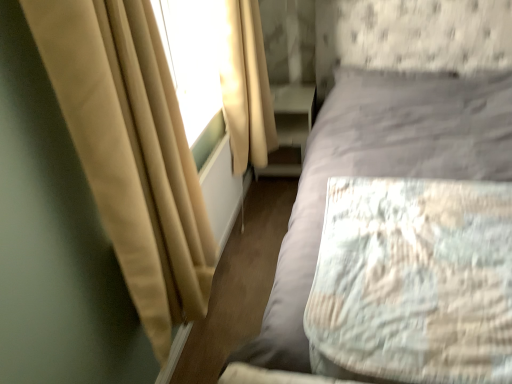
Where is `light gray fabric mattress at right`? This screenshot has width=512, height=384. light gray fabric mattress at right is located at coordinates (414, 280).

From a real-world perspective, is light gray fabric mattress at right located beneath beige fabric curtain at left, which appears as the first curtain when viewed from the front?

Indeed, from a real-world perspective, light gray fabric mattress at right is positioned beneath beige fabric curtain at left, which appears as the first curtain when viewed from the front.

Is light gray fabric mattress at right placed right next to beige fabric curtain at left, which appears as the first curtain when viewed from the front?

light gray fabric mattress at right and beige fabric curtain at left, which appears as the first curtain when viewed from the front, are clearly separated.

In the scene shown: Considering the relative positions of light gray fabric mattress at right and beige fabric curtain at left, placed as the 2th curtain when sorted from back to front, in the image provided, is light gray fabric mattress at right to the left of beige fabric curtain at left, placed as the 2th curtain when sorted from back to front, from the viewer's perspective?

In fact, light gray fabric mattress at right is to the right of beige fabric curtain at left, placed as the 2th curtain when sorted from back to front.

From the picture: From their relative heights in the image, would you say textured gray bed at center is taller or shorter than beige fabric curtain at upper left, arranged as the second curtain when viewed from the front?

textured gray bed at center is taller than beige fabric curtain at upper left, arranged as the second curtain when viewed from the front.

From a real-world perspective, count 1st curtains upward from the textured gray bed at center and point to it. Please provide its 2D coordinates.

[(245, 85)]

Does textured gray bed at center appear on the right side of beige fabric curtain at upper left, arranged as the second curtain when viewed from the front?

Yes.

In terms of height, does textured gray bed at center look taller or shorter compared to light gray fabric mattress at right?

Considering their sizes, textured gray bed at center has more height than light gray fabric mattress at right.

Is textured gray bed at center beside light gray fabric mattress at right?

There is a gap between textured gray bed at center and light gray fabric mattress at right.

Considering the relative positions of textured gray bed at center and light gray fabric mattress at right in the image provided, is textured gray bed at center behind light gray fabric mattress at right?

No, textured gray bed at center is in front of light gray fabric mattress at right.

Can you confirm if textured gray bed at center is wider than light gray fabric mattress at right?

Yes.

From a real-world perspective, is matte white dresser at lower center positioned over light gray fabric mattress at right based on gravity?

Incorrect, from a real-world perspective, matte white dresser at lower center is lower than light gray fabric mattress at right.

Does matte white dresser at lower center come behind light gray fabric mattress at right?

Yes, it is.

How much distance is there between matte white dresser at lower center and light gray fabric mattress at right?

matte white dresser at lower center is 4.51 feet away from light gray fabric mattress at right.

Find the location of a particular element. This screenshot has height=384, width=512. dresser below the light gray fabric mattress at right (from a real-world perspective) is located at coordinates (291, 125).

Is beige fabric curtain at upper left, arranged as the second curtain when viewed from the front, surrounded by beige fabric curtain at left, placed as the 2th curtain when sorted from back to front?

No, beige fabric curtain at upper left, arranged as the second curtain when viewed from the front, is not surrounded by beige fabric curtain at left, placed as the 2th curtain when sorted from back to front.

Who is shorter, beige fabric curtain at left, which appears as the first curtain when viewed from the front, or beige fabric curtain at upper left, the 1th curtain when ordered from back to front?

beige fabric curtain at upper left, the 1th curtain when ordered from back to front, is shorter.

Which is less distant, (160,75) or (260,116)?

Point (160,75) is closer to the camera than point (260,116).

From a real-world perspective, which is physically below, beige fabric curtain at left, which appears as the first curtain when viewed from the front, or beige fabric curtain at upper left, the 1th curtain when ordered from back to front?

beige fabric curtain at upper left, the 1th curtain when ordered from back to front, is physically lower.

Is beige fabric curtain at left, placed as the 2th curtain when sorted from back to front, thinner than textured gray bed at center?

Correct, the width of beige fabric curtain at left, placed as the 2th curtain when sorted from back to front, is less than that of textured gray bed at center.

Is beige fabric curtain at left, which appears as the first curtain when viewed from the front, positioned before textured gray bed at center?

No, beige fabric curtain at left, which appears as the first curtain when viewed from the front, is behind textured gray bed at center.

Considering the sizes of beige fabric curtain at left, which appears as the first curtain when viewed from the front, and textured gray bed at center in the image, is beige fabric curtain at left, which appears as the first curtain when viewed from the front, taller or shorter than textured gray bed at center?

Considering their sizes, beige fabric curtain at left, which appears as the first curtain when viewed from the front, has less height than textured gray bed at center.

How far apart are beige fabric curtain at left, placed as the 2th curtain when sorted from back to front, and textured gray bed at center?

The distance of beige fabric curtain at left, placed as the 2th curtain when sorted from back to front, from textured gray bed at center is 33.84 inches.

From the picture: From a real-world perspective, which object rests below the other?

matte white dresser at lower center is physically lower.

Based on their positions, is textured gray bed at center located to the left or right of matte white dresser at lower center?

Based on their positions, textured gray bed at center is located to the right of matte white dresser at lower center.

In terms of height, does textured gray bed at center look taller or shorter compared to matte white dresser at lower center?

textured gray bed at center is taller than matte white dresser at lower center.

I want to click on mattress on the right of beige fabric curtain at left, placed as the 2th curtain when sorted from back to front, so click(414, 280).

In order to click on bed beneath the beige fabric curtain at upper left, arranged as the second curtain when viewed from the front (from a real-world perspective) in this screenshot , I will do `click(391, 125)`.

Based on their spatial positions, is matte white dresser at lower center or light gray fabric mattress at right further from beige fabric curtain at upper left, arranged as the second curtain when viewed from the front?

light gray fabric mattress at right lies further to beige fabric curtain at upper left, arranged as the second curtain when viewed from the front, than the other object.

When comparing their distances from light gray fabric mattress at right, does matte white dresser at lower center or beige fabric curtain at left, placed as the 2th curtain when sorted from back to front, seem closer?

Based on the image, beige fabric curtain at left, placed as the 2th curtain when sorted from back to front, appears to be nearer to light gray fabric mattress at right.

Which object lies further to the anchor point textured gray bed at center, beige fabric curtain at upper left, arranged as the second curtain when viewed from the front, or beige fabric curtain at left, which appears as the first curtain when viewed from the front?

beige fabric curtain at left, which appears as the first curtain when viewed from the front, lies further to textured gray bed at center than the other object.

Based on their spatial positions, is textured gray bed at center or light gray fabric mattress at right further from matte white dresser at lower center?

Based on the image, light gray fabric mattress at right appears to be further to matte white dresser at lower center.

Estimate the real-world distances between objects in this image. Which object is further from matte white dresser at lower center, textured gray bed at center or beige fabric curtain at left, which appears as the first curtain when viewed from the front?

Among the two, beige fabric curtain at left, which appears as the first curtain when viewed from the front, is located further to matte white dresser at lower center.

Which object lies nearer to the anchor point beige fabric curtain at left, placed as the 2th curtain when sorted from back to front, beige fabric curtain at upper left, arranged as the second curtain when viewed from the front, or textured gray bed at center?

textured gray bed at center lies closer to beige fabric curtain at left, placed as the 2th curtain when sorted from back to front, than the other object.

Estimate the real-world distances between objects in this image. Which object is further from beige fabric curtain at upper left, the 1th curtain when ordered from back to front, textured gray bed at center or light gray fabric mattress at right?

Based on the image, light gray fabric mattress at right appears to be further to beige fabric curtain at upper left, the 1th curtain when ordered from back to front.

Considering their positions, is beige fabric curtain at left, placed as the 2th curtain when sorted from back to front, positioned closer to textured gray bed at center than beige fabric curtain at upper left, arranged as the second curtain when viewed from the front?

beige fabric curtain at upper left, arranged as the second curtain when viewed from the front, lies closer to textured gray bed at center than the other object.

Locate an element on the screen. Image resolution: width=512 pixels, height=384 pixels. mattress between textured gray bed at center and matte white dresser at lower center from front to back is located at coordinates (414, 280).

Locate an element on the screen. This screenshot has width=512, height=384. curtain between textured gray bed at center and beige fabric curtain at upper left, the 1th curtain when ordered from back to front, in the front-back direction is located at coordinates (132, 151).

You are a GUI agent. You are given a task and a screenshot of the screen. Output one action in this format:
    pyautogui.click(x=<x>, y=<y>)
    Task: Click on the curtain between light gray fabric mattress at right and matte white dresser at lower center along the z-axis
    
    Given the screenshot: What is the action you would take?
    pyautogui.click(x=245, y=85)

Locate an element on the screen. Image resolution: width=512 pixels, height=384 pixels. mattress between textured gray bed at center and beige fabric curtain at upper left, arranged as the second curtain when viewed from the front, in the front-back direction is located at coordinates (414, 280).